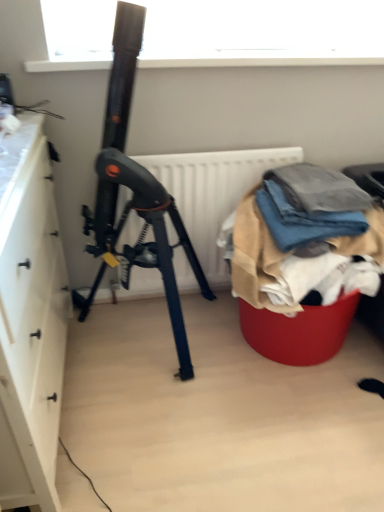
Locate an element on the screen. The image size is (384, 512). white matte radiator at center is located at coordinates (213, 192).

What are the coordinates of `denim fabric at right` in the screenshot? It's located at (301, 217).

You are a GUI agent. You are given a task and a screenshot of the screen. Output one action in this format:
    pyautogui.click(x=<x>, y=<y>)
    Task: Click on the white matte radiator at center
    
    Given the screenshot: What is the action you would take?
    pyautogui.click(x=213, y=192)

Is textured fabric pile at lower right far from white matte radiator at center?

Actually, textured fabric pile at lower right and white matte radiator at center are a little close together.

Image resolution: width=384 pixels, height=512 pixels. I want to click on radiator below the textured fabric pile at lower right (from a real-world perspective), so click(213, 192).

Does textured fabric pile at lower right turn towards white matte radiator at center?

No, textured fabric pile at lower right is not aimed at white matte radiator at center.

From a real-world perspective, which is physically above, denim fabric at right or white matte cabinet at left?

From a 3D spatial view, denim fabric at right is above.

Is point (310, 218) closer or farther from the camera than point (8, 352)?

Point (310, 218) is positioned farther from the camera compared to point (8, 352).

Do you think denim fabric at right is within white matte cabinet at left, or outside of it?

denim fabric at right exists outside the volume of white matte cabinet at left.

Between denim fabric at right and white matte cabinet at left, which one has smaller size?

With smaller size is denim fabric at right.

Is textured fabric pile at lower right smaller than white matte cabinet at left?

Indeed, textured fabric pile at lower right has a smaller size compared to white matte cabinet at left.

From the picture: Considering the sizes of objects textured fabric pile at lower right and white matte cabinet at left in the image provided, who is wider, textured fabric pile at lower right or white matte cabinet at left?

textured fabric pile at lower right.

Consider the image. Is white matte cabinet at left at the back of textured fabric pile at lower right?

That's not correct — textured fabric pile at lower right is not looking away from white matte cabinet at left.

From a real-world perspective, which object rests below the other?

textured fabric pile at lower right.

Which is closer to the camera, (x=322, y=234) or (x=358, y=248)?

Point (x=322, y=234).

Would you consider denim fabric at right to be distant from textured fabric pile at lower right?

That's not correct — denim fabric at right is a little close to textured fabric pile at lower right.

From the image's perspective, between denim fabric at right and textured fabric pile at lower right, who is located below?

textured fabric pile at lower right, from the image's perspective.

Could you tell me if white matte cabinet at left is turned towards denim fabric at right?

Yes, white matte cabinet at left is oriented towards denim fabric at right.

From a real-world perspective, which object stands above the other?

denim fabric at right, from a real-world perspective.

Considering the relative sizes of white matte cabinet at left and denim fabric at right in the image provided, is white matte cabinet at left smaller than denim fabric at right?

Incorrect, white matte cabinet at left is not smaller in size than denim fabric at right.

Identify the location of radiator that is on the right side of white matte cabinet at left. (213, 192).

Is white matte cabinet at left thinner than white matte radiator at center?

Incorrect, the width of white matte cabinet at left is not less than that of white matte radiator at center.

From the image's perspective, is white matte cabinet at left on top of white matte radiator at center?

No, from the image's perspective, white matte cabinet at left is not on top of white matte radiator at center.

Considering the sizes of objects white matte cabinet at left and white matte radiator at center in the image provided, who is shorter, white matte cabinet at left or white matte radiator at center?

white matte radiator at center.

Considering their positions, is white matte radiator at center located in front of or behind denim fabric at right?

Visually, white matte radiator at center is located behind denim fabric at right.

Is white matte radiator at center turned away from denim fabric at right?

No, white matte radiator at center's orientation is not away from denim fabric at right.

Considering the relative sizes of white matte radiator at center and denim fabric at right in the image provided, is white matte radiator at center taller than denim fabric at right?

Correct, white matte radiator at center is much taller as denim fabric at right.

Is white matte radiator at center wider than denim fabric at right?

No.

The width and height of the screenshot is (384, 512). I want to click on waste on the right of white matte radiator at center, so click(255, 257).

Locate an element on the screen. This screenshot has width=384, height=512. clothing behind the white matte cabinet at left is located at coordinates (301, 217).

Which object lies further to the anchor point white matte cabinet at left, denim fabric at right or textured fabric pile at lower right?

denim fabric at right.

When comparing their distances from denim fabric at right, does white matte cabinet at left or textured fabric pile at lower right seem closer?

textured fabric pile at lower right is closer to denim fabric at right.

Which object lies nearer to the anchor point white matte radiator at center, white matte cabinet at left or textured fabric pile at lower right?

The object closer to white matte radiator at center is textured fabric pile at lower right.

Based on their spatial positions, is textured fabric pile at lower right or white matte radiator at center further from white matte cabinet at left?

The object further to white matte cabinet at left is textured fabric pile at lower right.

Which object lies further to the anchor point denim fabric at right, textured fabric pile at lower right or white matte radiator at center?

white matte radiator at center is positioned further to the anchor denim fabric at right.

Estimate the real-world distances between objects in this image. Which object is further from white matte radiator at center, white matte cabinet at left or denim fabric at right?

Among the two, white matte cabinet at left is located further to white matte radiator at center.

Based on their spatial positions, is white matte cabinet at left or white matte radiator at center further from textured fabric pile at lower right?

The object further to textured fabric pile at lower right is white matte cabinet at left.

Based on their spatial positions, is denim fabric at right or textured fabric pile at lower right closer to white matte radiator at center?

Based on the image, textured fabric pile at lower right appears to be nearer to white matte radiator at center.

Locate an element on the screen. The image size is (384, 512). clothing situated between white matte radiator at center and textured fabric pile at lower right from left to right is located at coordinates (x=301, y=217).

You are a GUI agent. You are given a task and a screenshot of the screen. Output one action in this format:
    pyautogui.click(x=<x>, y=<y>)
    Task: Click on the clothing between white matte cabinet at left and textured fabric pile at lower right in the horizontal direction
    Image resolution: width=384 pixels, height=512 pixels.
    Given the screenshot: What is the action you would take?
    point(301,217)

You are a GUI agent. You are given a task and a screenshot of the screen. Output one action in this format:
    pyautogui.click(x=<x>, y=<y>)
    Task: Click on the radiator between white matte cabinet at left and textured fabric pile at lower right from left to right
    
    Given the screenshot: What is the action you would take?
    pyautogui.click(x=213, y=192)

Find the location of a particular element. The height and width of the screenshot is (512, 384). clothing between white matte cabinet at left and white matte radiator at center from front to back is located at coordinates (301, 217).